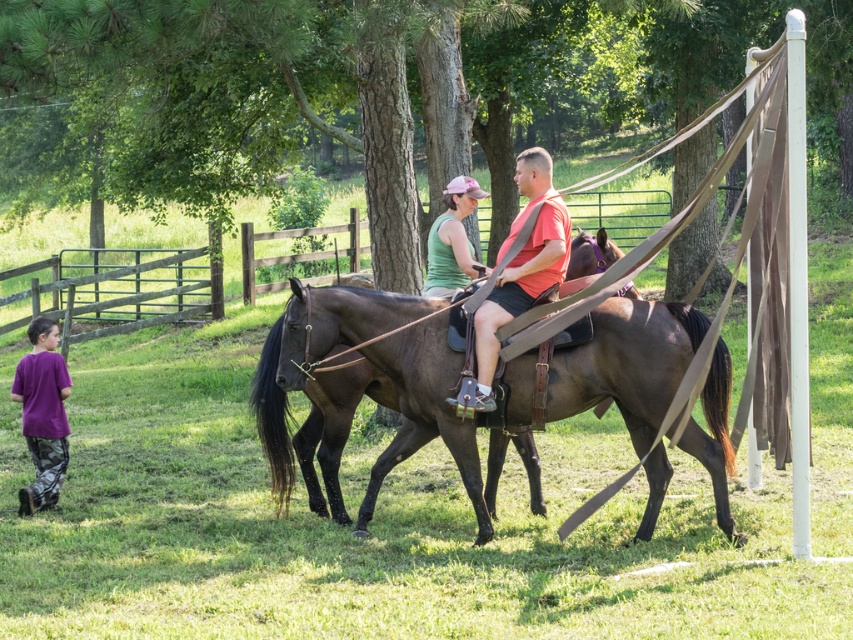
You are a photographer planning to take a photo of the shiny brown horse at center and the matte brown leather saddle at center. You want to ensure both are fully visible in the frame. Given that your camera has a fixed width setting, which object requires a wider frame to capture its full size?

The shiny brown horse at center requires a wider frame because its width is larger than the matte brown leather saddle at center.

You are a photographer positioned at the center of the scene. You want to capture a photo that includes both the purple cotton shirt at lower left and the wooden fence in the background. Based on their positions, which object should you adjust your camera angle to focus on first to ensure both are in frame?

The purple cotton shirt at lower left is located at the lower left part of the scene, so you should first adjust your camera angle to focus on the purple cotton shirt at lower left to ensure both it and the wooden fence in the background are included in the frame.